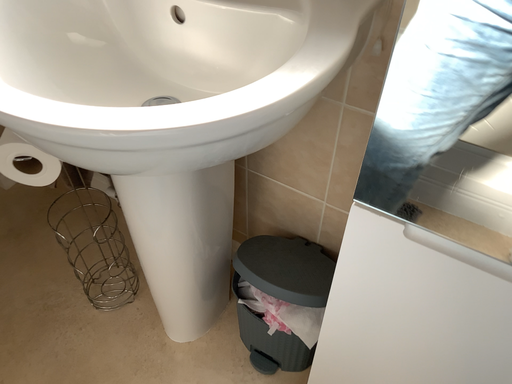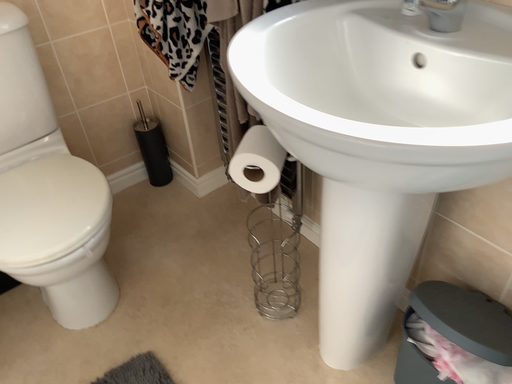
Question: How did the camera likely rotate when shooting the video?

Choices:
 (A) rotated left
 (B) rotated right

Answer: (A)